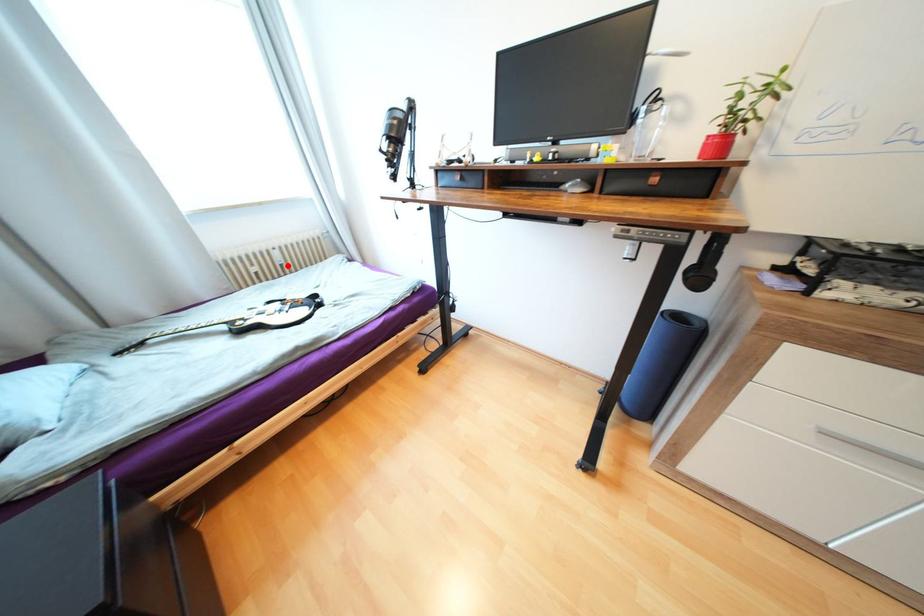
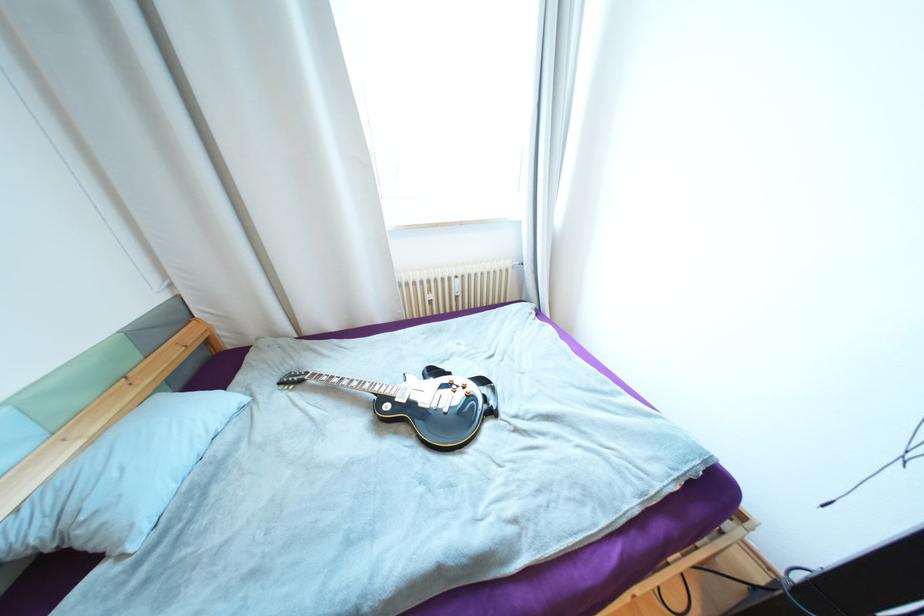
Locate, in the second image, the point that corresponds to the highlighted location in the first image.

(463, 297)